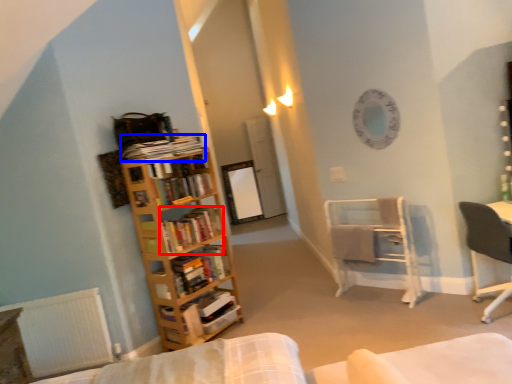
Question: Which of the following is the farthest to the observer, book (highlighted by a red box) or book (highlighted by a blue box)?

Choices:
 (A) book
 (B) book

Answer: (A)